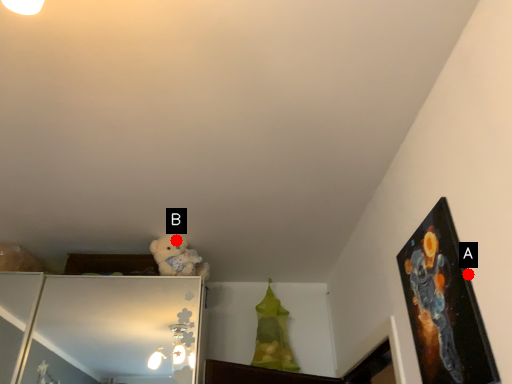
Question: Two points are circled on the image, labeled by A and B beside each circle. Which point is closer to the camera?

Choices:
 (A) A is closer
 (B) B is closer

Answer: (A)